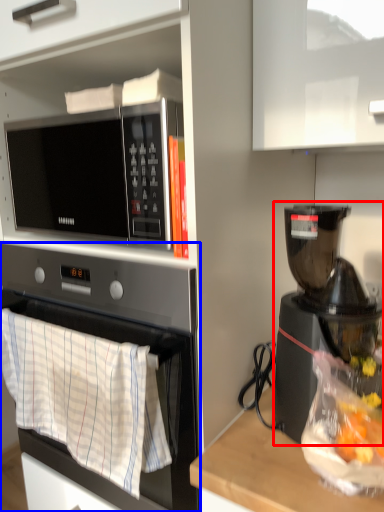
Question: Which point is closer to the camera, coffee maker (highlighted by a red box) or oven (highlighted by a blue box)?

Choices:
 (A) coffee maker
 (B) oven

Answer: (A)